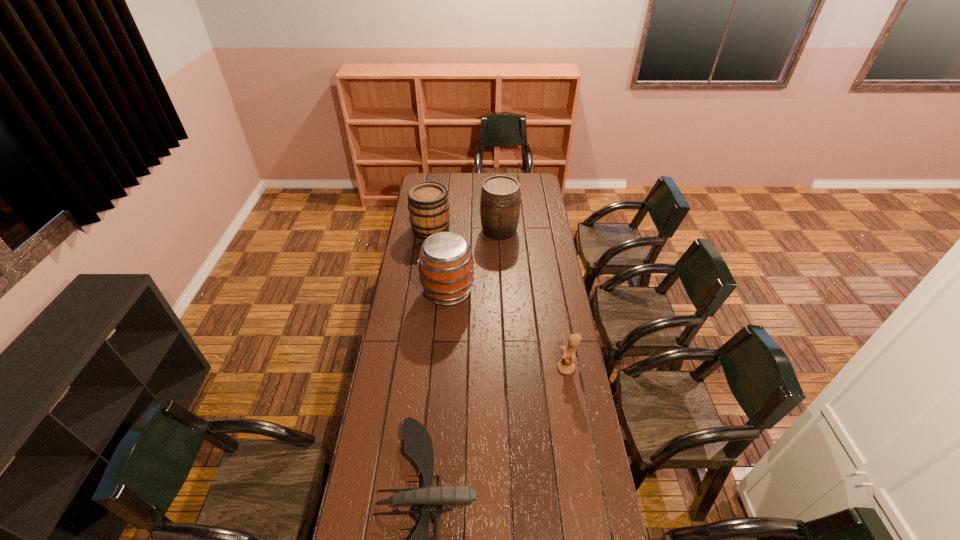
Find the location of a particular element. free space between the third nearest object and the fourth tallest object is located at coordinates (507, 330).

Identify the location of free area in between the rightmost object and the fourth object from left to right. The width and height of the screenshot is (960, 540). (533, 299).

This screenshot has height=540, width=960. Find the location of `object that is the nearest to the shortest cider`. object that is the nearest to the shortest cider is located at coordinates (500, 196).

Identify the location of the closest object to the fourth farthest object. (418, 445).

Point out which cider is positioned as the nearest to the third nearest object. Please provide its 2D coordinates. Your answer should be formatted as a tuple, i.e. [(x, y)], where the tuple contains the x and y coordinates of a point satisfying the conditions above.

[(500, 196)]

Locate an element on the screen. The image size is (960, 540). cider identified as the closest to the nearest object is located at coordinates (446, 266).